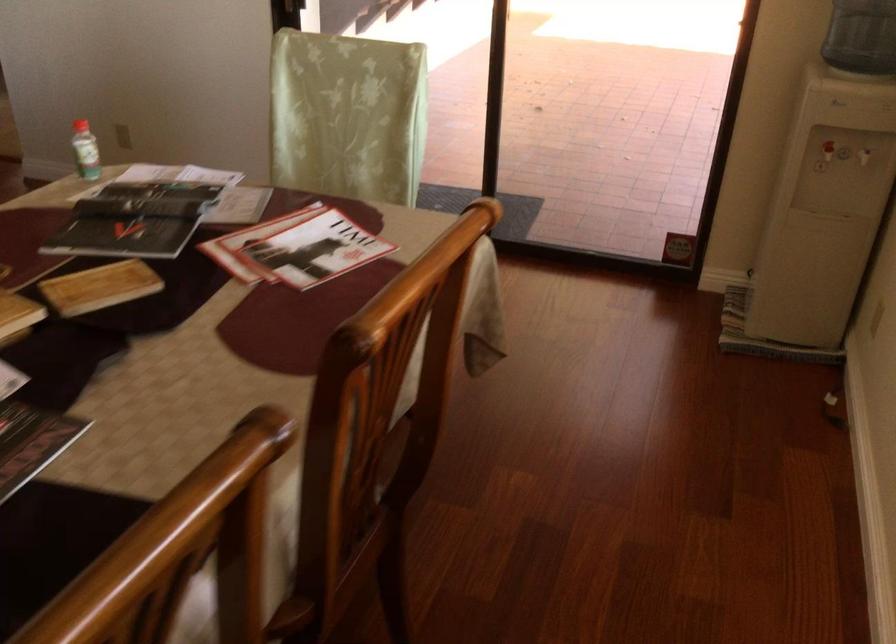
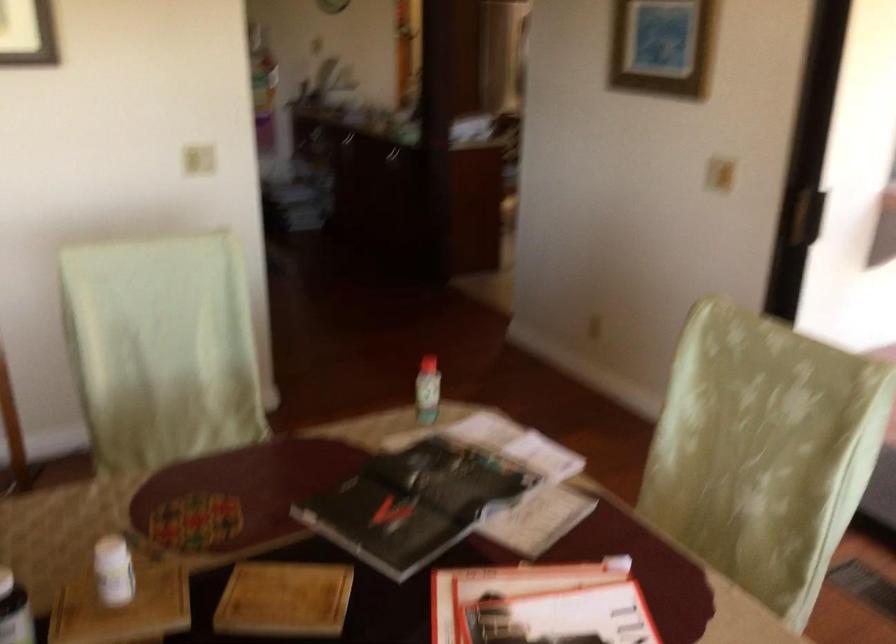
Question: The camera is either moving clockwise (left) or counter-clockwise (right) around the object. The first image is from the beginning of the video and the second image is from the end. Is the camera moving left or right when shooting the video?

Choices:
 (A) Left
 (B) Right

Answer: (B)